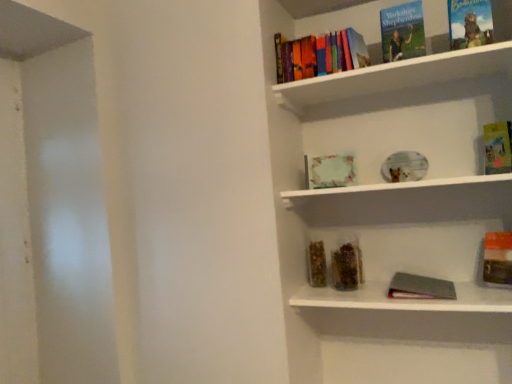
Question: Considering the relative sizes of gray matte book at lower right, placed as the 1th book when sorted from bottom to top, and hardcover books at upper center in the image provided, is gray matte book at lower right, placed as the 1th book when sorted from bottom to top, taller than hardcover books at upper center?

Choices:
 (A) no
 (B) yes

Answer: (B)

Question: Considering the relative positions of gray matte book at lower right, placed as the 1th book when sorted from bottom to top, and hardcover books at upper center in the image provided, is gray matte book at lower right, placed as the 1th book when sorted from bottom to top, to the right of hardcover books at upper center from the viewer's perspective?

Choices:
 (A) no
 (B) yes

Answer: (B)

Question: Is gray matte book at lower right, which is counted as the 8th book, starting from the top, outside of hardcover books at upper center?

Choices:
 (A) yes
 (B) no

Answer: (A)

Question: Are gray matte book at lower right, which is counted as the 8th book, starting from the top, and hardcover books at upper center far apart?

Choices:
 (A) no
 (B) yes

Answer: (A)

Question: Is gray matte book at lower right, which is counted as the 8th book, starting from the top, wider than hardcover books at upper center?

Choices:
 (A) no
 (B) yes

Answer: (A)

Question: From the image's perspective, is metallic silver book at lower center, the second window sill when ordered from top to bottom, located above or below orange matte book at lower right, positioned as the third book in bottom-to-top order?

Choices:
 (A) below
 (B) above

Answer: (A)

Question: Would you say metallic silver book at lower center, the second window sill when ordered from top to bottom, is to the left or to the right of orange matte book at lower right, positioned as the third book in bottom-to-top order, in the picture?

Choices:
 (A) right
 (B) left

Answer: (B)

Question: Is metallic silver book at lower center, the second window sill when ordered from top to bottom, wider or thinner than orange matte book at lower right, positioned as the third book in bottom-to-top order?

Choices:
 (A) wide
 (B) thin

Answer: (A)

Question: Considering the positions of metallic silver book at lower center, arranged as the 1th window sill when ordered from the bottom, and orange matte book at lower right, which is the 6th book from top to bottom, in the image, is metallic silver book at lower center, arranged as the 1th window sill when ordered from the bottom, bigger or smaller than orange matte book at lower right, which is the 6th book from top to bottom,?

Choices:
 (A) small
 (B) big

Answer: (B)

Question: Based on their sizes in the image, would you say hardcover books at upper center is bigger or smaller than hardcover books at upper center, marked as the 3th book in a top-to-bottom arrangement?

Choices:
 (A) big
 (B) small

Answer: (A)

Question: Based on their positions, is hardcover books at upper center located to the left or right of hardcover books at upper center, which is the sixth book in bottom-to-top order?

Choices:
 (A) right
 (B) left

Answer: (A)

Question: Is point (276, 84) closer or farther from the camera than point (276, 79)?

Choices:
 (A) closer
 (B) farther

Answer: (A)

Question: Relative to hardcover books at upper center, which is the sixth book in bottom-to-top order, is hardcover books at upper center in front or behind?

Choices:
 (A) behind
 (B) front

Answer: (B)

Question: Considering the positions of gray matte book at lower right, which is counted as the 8th book, starting from the top, and white matte plate at center, which is counted as the 1th window sill, starting from the top, in the image, is gray matte book at lower right, which is counted as the 8th book, starting from the top, wider or thinner than white matte plate at center, which is counted as the 1th window sill, starting from the top,?

Choices:
 (A) thin
 (B) wide

Answer: (A)

Question: In the image, is gray matte book at lower right, which is counted as the 8th book, starting from the top, positioned in front of or behind white matte plate at center, the 2th window sill ordered from the bottom?

Choices:
 (A) behind
 (B) front

Answer: (A)